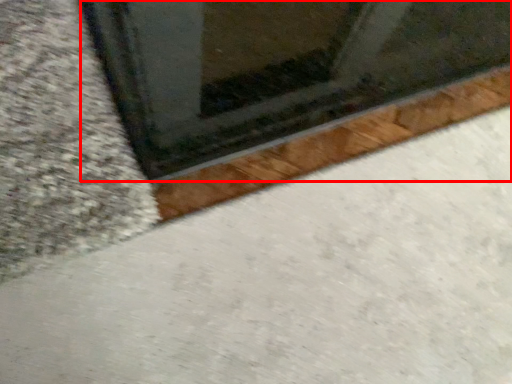
Question: From the image's perspective, what is the correct spatial relationship of window (annotated by the red box) in relation to concrete?

Choices:
 (A) above
 (B) below

Answer: (A)